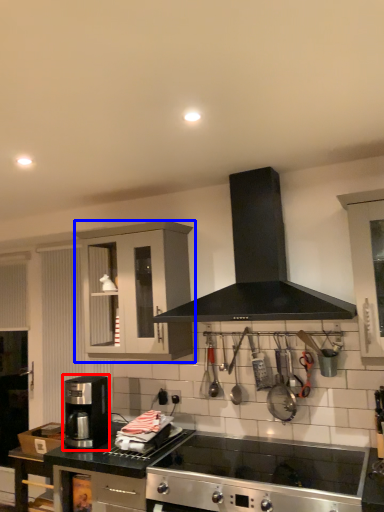
Question: Which object is closer to the camera taking this photo, coffee maker (highlighted by a red box) or cabinetry (highlighted by a blue box)?

Choices:
 (A) coffee maker
 (B) cabinetry

Answer: (A)